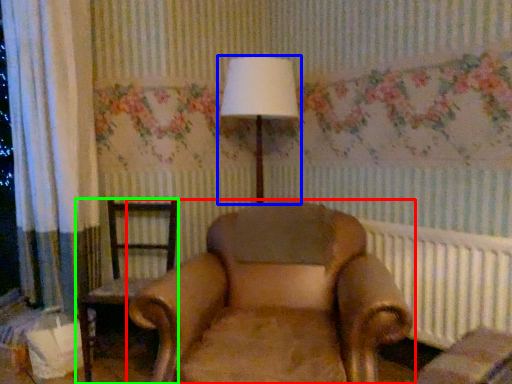
Question: Based on their relative distances, which object is farther from chair (highlighted by a red box)? Choose from lamp (highlighted by a blue box) and chair (highlighted by a green box).

Choices:
 (A) lamp
 (B) chair

Answer: (A)